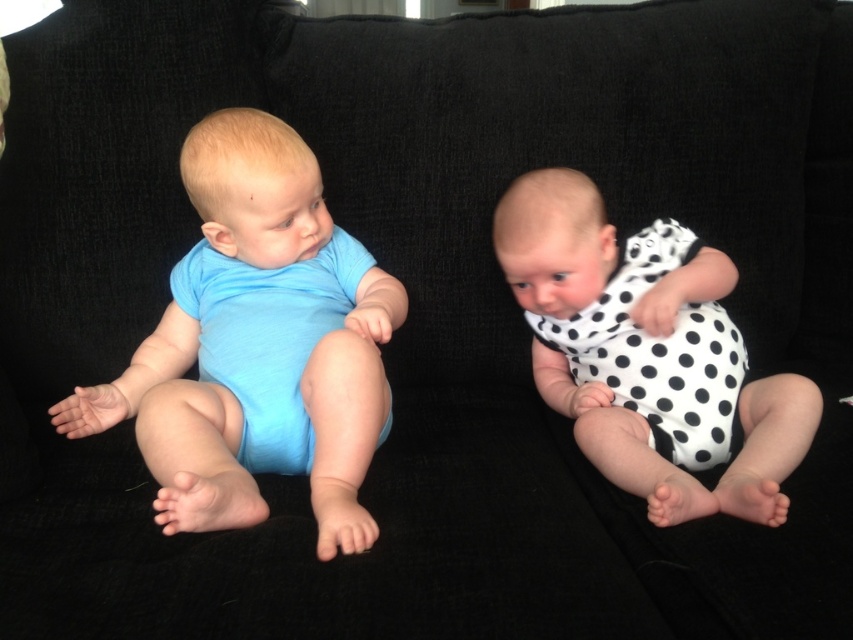
Question: Is matte blue onesie at left positioned at the back of white dotted fabric at right?

Choices:
 (A) no
 (B) yes

Answer: (A)

Question: Can you confirm if matte blue onesie at left is thinner than white dotted fabric at right?

Choices:
 (A) yes
 (B) no

Answer: (B)

Question: Which point appears closest to the camera in this image?

Choices:
 (A) (601, 353)
 (B) (244, 124)

Answer: (B)

Question: Which of the following is the farthest from the observer?

Choices:
 (A) (592, 346)
 (B) (305, 154)

Answer: (A)

Question: Is matte blue onesie at left to the right of white dotted fabric at right from the viewer's perspective?

Choices:
 (A) yes
 (B) no

Answer: (B)